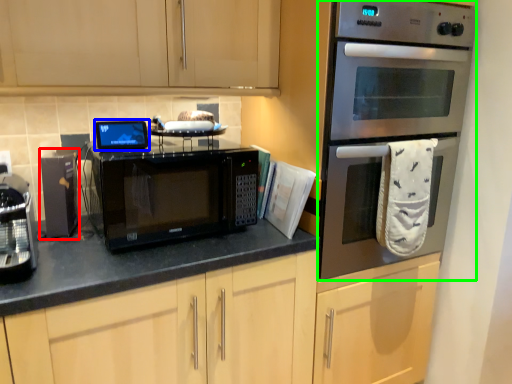
Question: Which object is the farthest from appliance (highlighted by a red box)? Choose among these: appliance (highlighted by a blue box) or oven (highlighted by a green box).

Choices:
 (A) appliance
 (B) oven

Answer: (B)